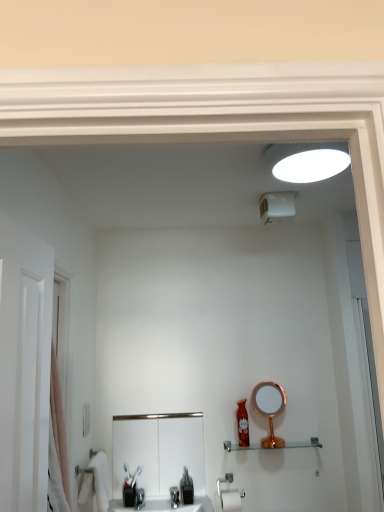
Question: Considering the relative sizes of black plastic soap dispenser at lower center and matte red bottle at center in the image provided, is black plastic soap dispenser at lower center wider than matte red bottle at center?

Choices:
 (A) yes
 (B) no

Answer: (A)

Question: Could matte red bottle at center be considered to be inside black plastic soap dispenser at lower center?

Choices:
 (A) no
 (B) yes

Answer: (A)

Question: Is black plastic soap dispenser at lower center turned away from matte red bottle at center?

Choices:
 (A) no
 (B) yes

Answer: (A)

Question: Considering the relative sizes of black plastic soap dispenser at lower center and matte red bottle at center in the image provided, is black plastic soap dispenser at lower center thinner than matte red bottle at center?

Choices:
 (A) no
 (B) yes

Answer: (A)

Question: From a real-world perspective, is black plastic soap dispenser at lower center on top of matte red bottle at center?

Choices:
 (A) yes
 (B) no

Answer: (B)

Question: Which is correct: pink fabric shower curtain at left is inside satin nickel sink at center, or outside of it?

Choices:
 (A) outside
 (B) inside

Answer: (A)

Question: Considering the positions of point (57, 375) and point (173, 475), is point (57, 375) closer or farther from the camera than point (173, 475)?

Choices:
 (A) farther
 (B) closer

Answer: (B)

Question: From a real-world perspective, is pink fabric shower curtain at left above or below satin nickel sink at center?

Choices:
 (A) below
 (B) above

Answer: (B)

Question: From their relative heights in the image, would you say pink fabric shower curtain at left is taller or shorter than satin nickel sink at center?

Choices:
 (A) short
 (B) tall

Answer: (B)

Question: From a real-world perspective, relative to clear glass shelf at center, is black plastic soap dispenser at lower center vertically above or below?

Choices:
 (A) above
 (B) below

Answer: (B)

Question: Is black plastic soap dispenser at lower center taller or shorter than clear glass shelf at center?

Choices:
 (A) tall
 (B) short

Answer: (A)

Question: Is black plastic soap dispenser at lower center to the left or to the right of clear glass shelf at center in the image?

Choices:
 (A) left
 (B) right

Answer: (A)

Question: From the image's perspective, is black plastic soap dispenser at lower center located above or below clear glass shelf at center?

Choices:
 (A) below
 (B) above

Answer: (A)

Question: Is black plastic soap dispenser at lower center bigger or smaller than matte red bottle at center?

Choices:
 (A) small
 (B) big

Answer: (A)

Question: Relative to matte red bottle at center, is black plastic soap dispenser at lower center in front or behind?

Choices:
 (A) front
 (B) behind

Answer: (A)